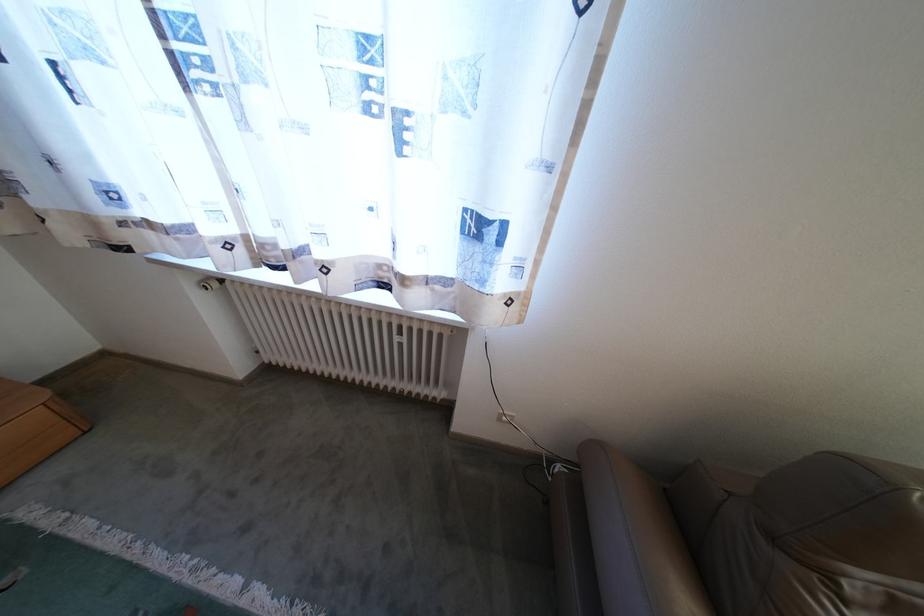
This screenshot has width=924, height=616. What do you see at coordinates (628, 537) in the screenshot?
I see `a brown sofa armrest` at bounding box center [628, 537].